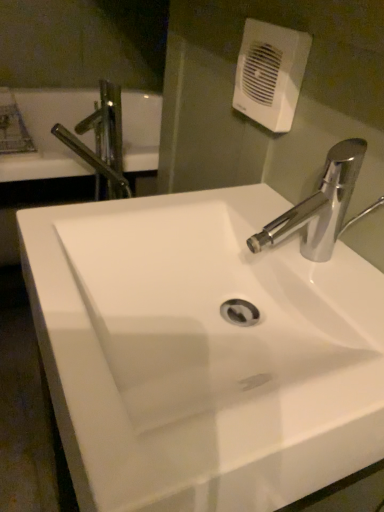
Question: From the image's perspective, is white glossy sink at center above or below metallic chrome tap at upper left?

Choices:
 (A) above
 (B) below

Answer: (B)

Question: Relative to metallic chrome tap at upper left, is white glossy sink at center in front or behind?

Choices:
 (A) front
 (B) behind

Answer: (A)

Question: Considering the real-world distances, which object is farthest from the white glossy sink at center?

Choices:
 (A) white plastic hand dryer at upper center
 (B) metallic chrome tap at upper left

Answer: (B)

Question: Based on their relative distances, which object is farther from the metallic chrome tap at upper left?

Choices:
 (A) white plastic hand dryer at upper center
 (B) white glossy sink at center

Answer: (B)